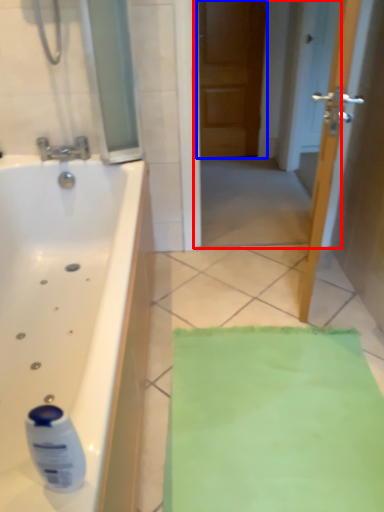
Question: Among these objects, which one is nearest to the camera, screen door (highlighted by a red box) or door (highlighted by a blue box)?

Choices:
 (A) screen door
 (B) door

Answer: (A)